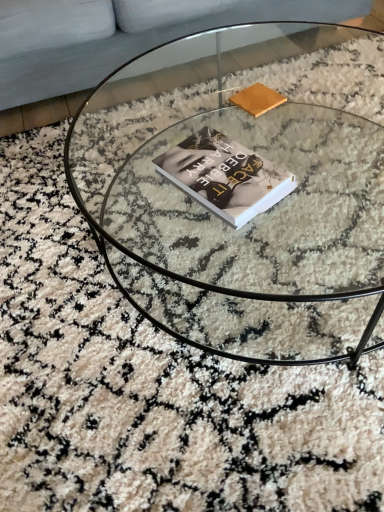
Question: Looking at the image, does light gray fabric couch at upper left seem bigger or smaller compared to hardcover book at center?

Choices:
 (A) big
 (B) small

Answer: (A)

Question: Is point click(x=19, y=83) positioned closer to the camera than point click(x=188, y=185)?

Choices:
 (A) closer
 (B) farther

Answer: (B)

Question: Estimate the real-world distances between objects in this image. Which object is closer to the light gray fabric couch at upper left?

Choices:
 (A) matte brown book at upper center
 (B) hardcover book at center
 (C) transparent glass coffee table at center

Answer: (C)

Question: Which is farther from the matte brown book at upper center?

Choices:
 (A) hardcover book at center
 (B) light gray fabric couch at upper left
 (C) transparent glass coffee table at center

Answer: (B)